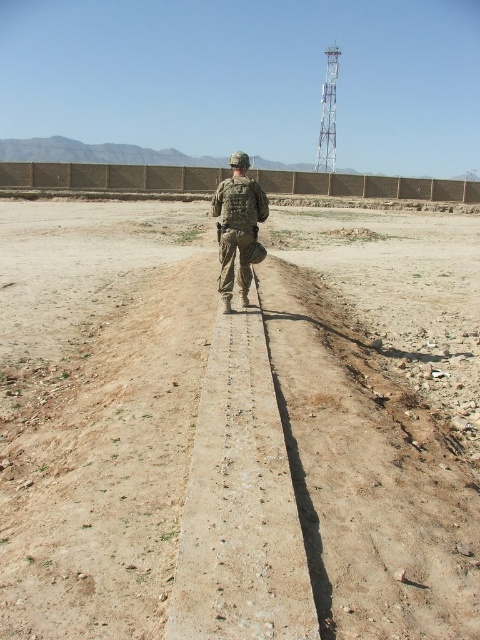
Question: Is dusty brown dirt at center behind camouflage fabric uniform at center?

Choices:
 (A) yes
 (B) no

Answer: (B)

Question: Is dusty brown dirt at center thinner than camouflage fabric uniform at center?

Choices:
 (A) yes
 (B) no

Answer: (B)

Question: Which point is farther from the camera taking this photo?

Choices:
 (A) (4, 468)
 (B) (236, 236)

Answer: (B)

Question: Considering the relative positions of dusty brown dirt at center and camouflage fabric uniform at center in the image provided, where is dusty brown dirt at center located with respect to camouflage fabric uniform at center?

Choices:
 (A) above
 (B) below

Answer: (B)